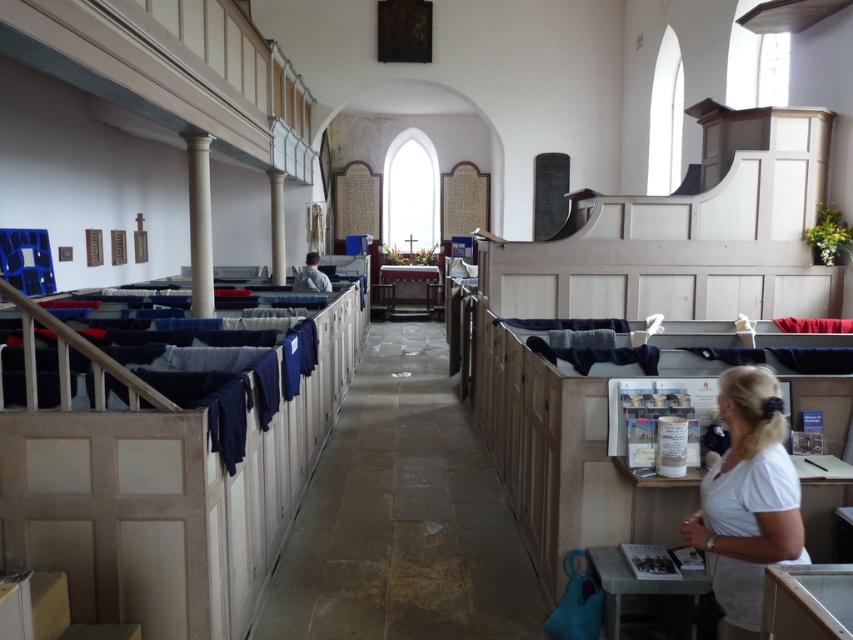
You are standing at the entrance of the church and notice a white cotton shirt at lower right and a white polished column at center. Which object is closer to your eye level?

The white polished column at center is taller than the white cotton shirt at lower right, so it is closer to your eye level.